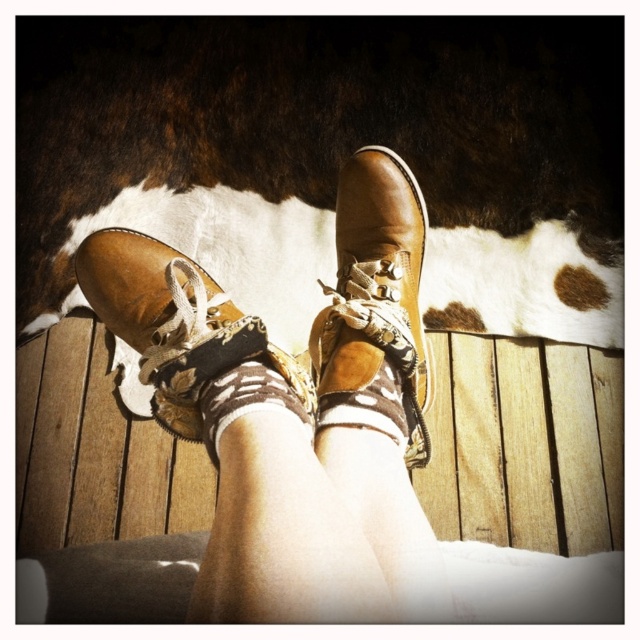
Question: Is brown leather shoe at center to the left of brown suede socks at center from the viewer's perspective?

Choices:
 (A) yes
 (B) no

Answer: (A)

Question: Among these points, which one is nearest to the camera?

Choices:
 (A) tap(348, 368)
 (B) tap(356, 378)
 (C) tap(216, 413)

Answer: (C)

Question: Does leather boots at center have a lesser width compared to brown leather shoe at center?

Choices:
 (A) yes
 (B) no

Answer: (B)

Question: Which point appears farthest from the camera in this image?

Choices:
 (A) (349, 179)
 (B) (269, 401)
 (C) (380, 160)
 (D) (312, 387)

Answer: (A)

Question: Is leather boots at center smaller than leather boot at center?

Choices:
 (A) no
 (B) yes

Answer: (A)

Question: Estimate the real-world distances between objects in this image. Which object is farther from the brown suede socks at center?

Choices:
 (A) brown leather shoe at center
 (B) leather boot at center

Answer: (B)